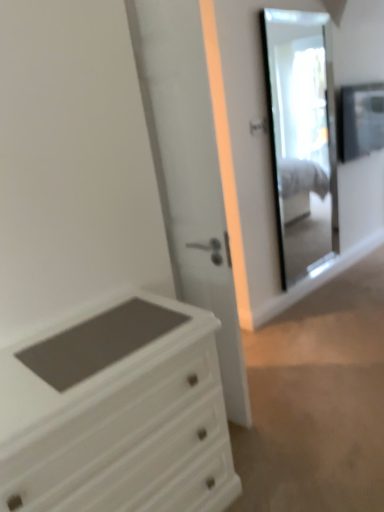
Locate an element on the screen. Image resolution: width=384 pixels, height=512 pixels. free spot above white wood chest of drawers at lower left (from a real-world perspective) is located at coordinates (75, 347).